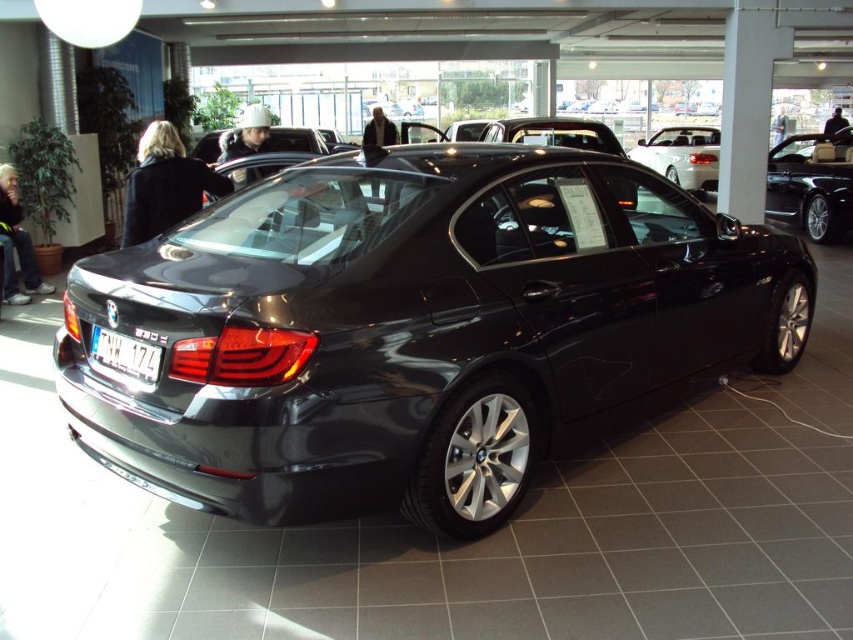
Question: Does satin silver sedan at center have a smaller size compared to white plastic license plate at rear?

Choices:
 (A) yes
 (B) no

Answer: (B)

Question: Which point is closer to the camera?

Choices:
 (A) white plastic license plate at rear
 (B) glossy metallic car at center

Answer: (B)

Question: Can you confirm if glossy metallic car at center is smaller than white plastic license plate at rear?

Choices:
 (A) yes
 (B) no

Answer: (B)

Question: Considering the real-world distances, which object is closest to the white plastic license plate at rear?

Choices:
 (A) glossy metallic car at center
 (B) satin silver sedan at center

Answer: (A)

Question: Which point is closer to the camera?

Choices:
 (A) glossy metallic car at center
 (B) white plastic license plate at rear
 (C) satin silver sedan at center

Answer: (A)

Question: Does glossy metallic car at center lie in front of white plastic license plate at rear?

Choices:
 (A) yes
 (B) no

Answer: (A)